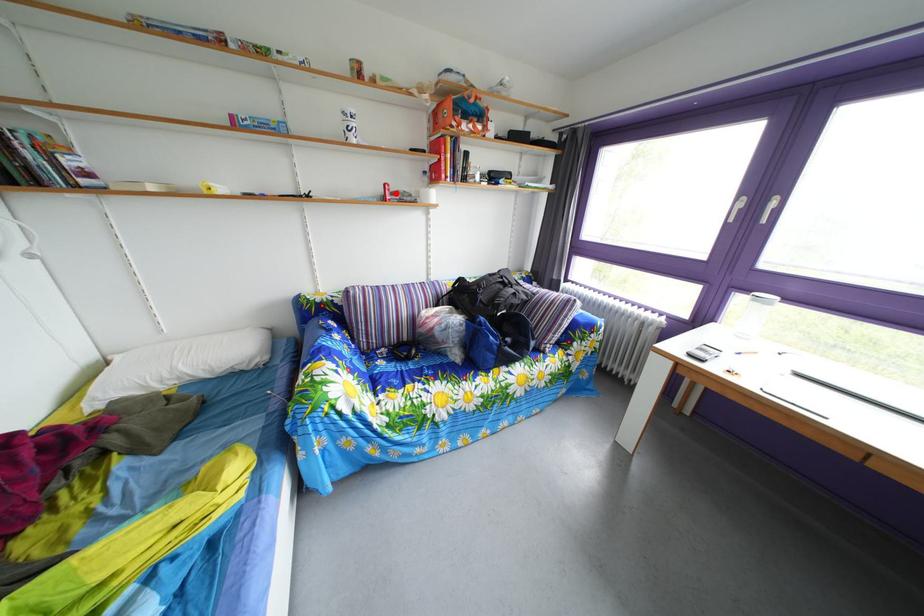
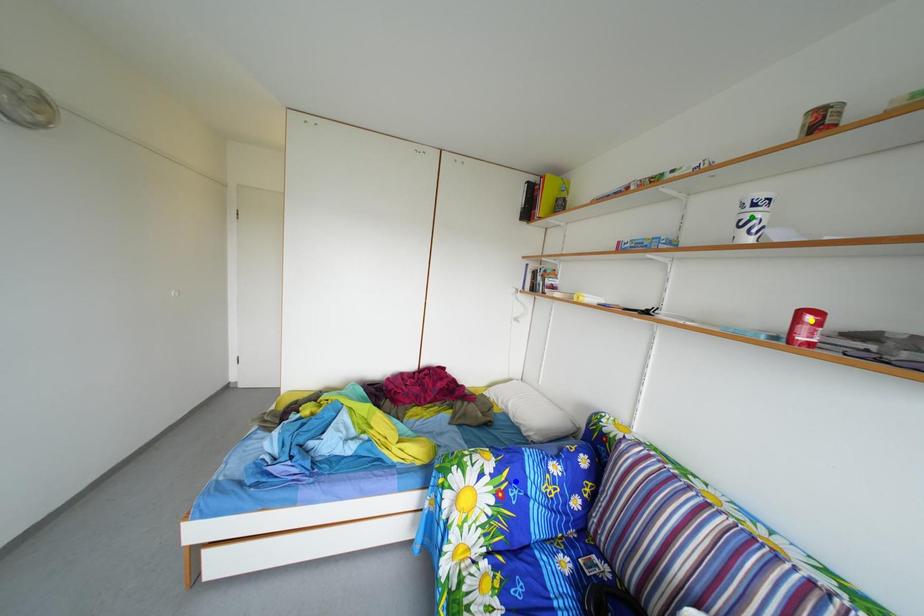
Question: I am providing you with two images of the same scene from different viewpoints. A red point is marked on the first image. You are given multiple points on the second image. Which point in image 2 represents the same 3d spot as the red point in image 1?

Choices:
 (A) blue point
 (B) yellow point
 (C) green point

Answer: (B)